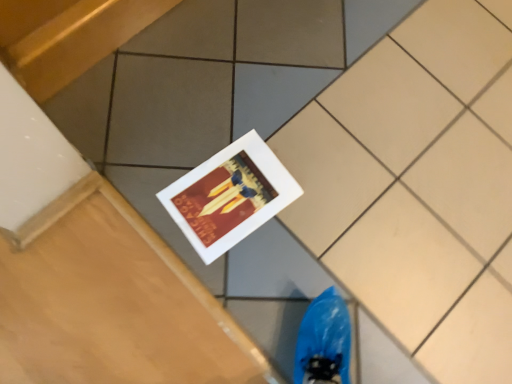
Identify the location of free space below white matte picture frame at center (from a real-world perspective). This screenshot has width=512, height=384. (236, 193).